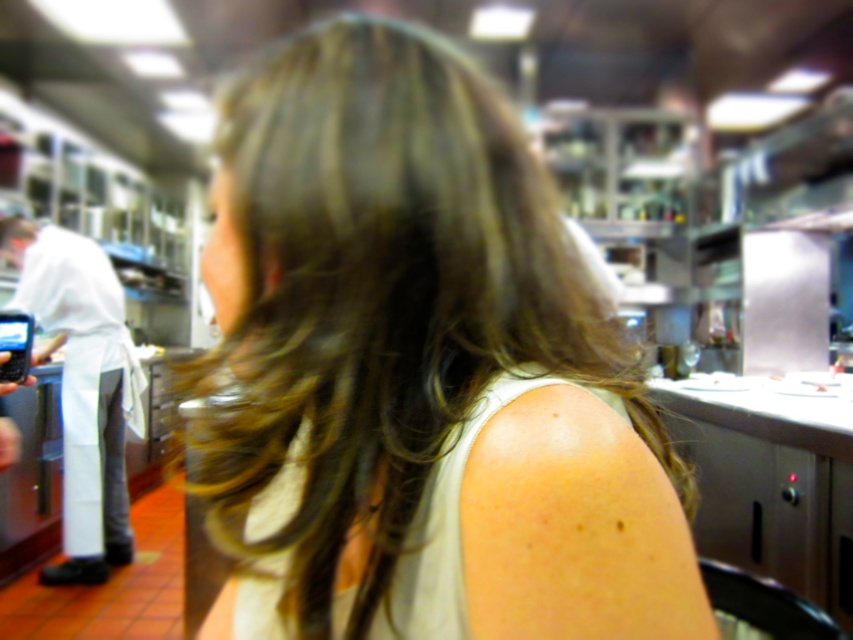
How far apart are white fabric apron at left and black plastic phone at left?

white fabric apron at left and black plastic phone at left are 3.55 feet apart.

Is white fabric apron at left taller than black plastic phone at left?

Yes.

Between point (9, 227) and point (10, 353), which one is positioned behind?

Positioned behind is point (9, 227).

In order to click on white fabric apron at left in this screenshot , I will do `click(83, 387)`.

Can you confirm if brown wavy hair at center is positioned to the left of white fabric apron at left?

No, brown wavy hair at center is not to the left of white fabric apron at left.

Between point (619, 468) and point (74, 563), which one is positioned behind?

Point (74, 563)

Image resolution: width=853 pixels, height=640 pixels. I want to click on brown wavy hair at center, so click(418, 369).

Image resolution: width=853 pixels, height=640 pixels. Identify the location of brown wavy hair at center. (418, 369).

Who is more forward, (668, 552) or (7, 332)?

Point (668, 552) is in front.

Does brown wavy hair at center have a lesser width compared to black plastic phone at left?

In fact, brown wavy hair at center might be wider than black plastic phone at left.

What are the coordinates of `brown wavy hair at center` in the screenshot? It's located at (418, 369).

Image resolution: width=853 pixels, height=640 pixels. I want to click on brown wavy hair at center, so click(x=418, y=369).